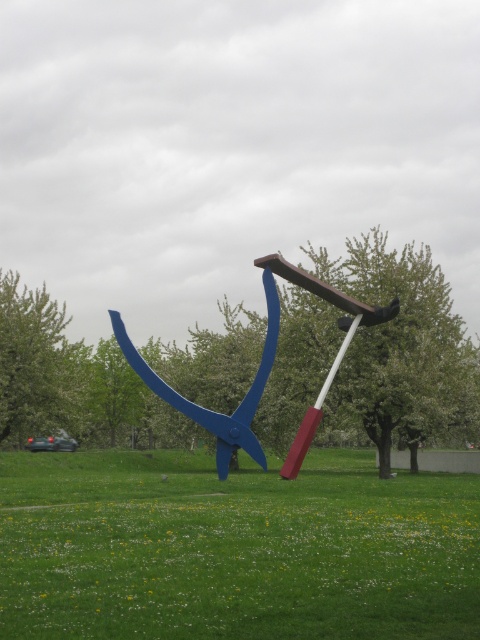
Question: Can you confirm if green grass at center is positioned below metallic blue scissor at center?

Choices:
 (A) yes
 (B) no

Answer: (A)

Question: Does green grass at center have a greater width compared to metallic blue scissor at center?

Choices:
 (A) no
 (B) yes

Answer: (B)

Question: Which object appears closest to the camera in this image?

Choices:
 (A) metallic blue scissor at center
 (B) green grass at center

Answer: (B)

Question: Observing the image, what is the correct spatial positioning of green grass at center in reference to metallic blue scissor at center?

Choices:
 (A) below
 (B) above

Answer: (A)

Question: Which point is closer to the camera taking this photo?

Choices:
 (A) (268, 264)
 (B) (63, 516)

Answer: (B)